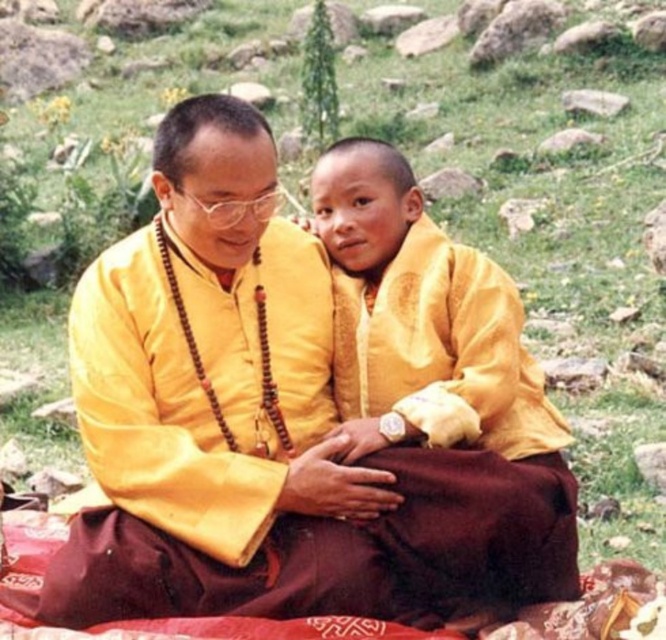
What is located at the coordinates point (264, 429)?

The yellow silk robe at center is located at point (264, 429).